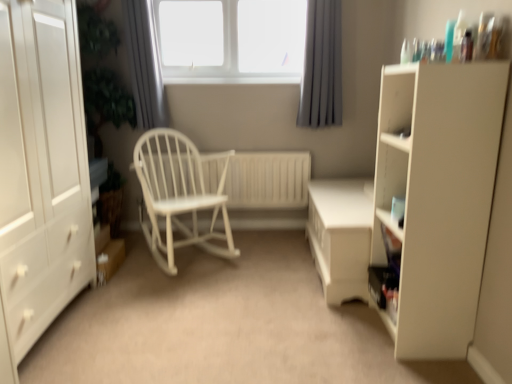
Locate an element on the screen. The height and width of the screenshot is (384, 512). vacant space in between white wood rocking chair at center and matte white cupboard at right is located at coordinates (272, 288).